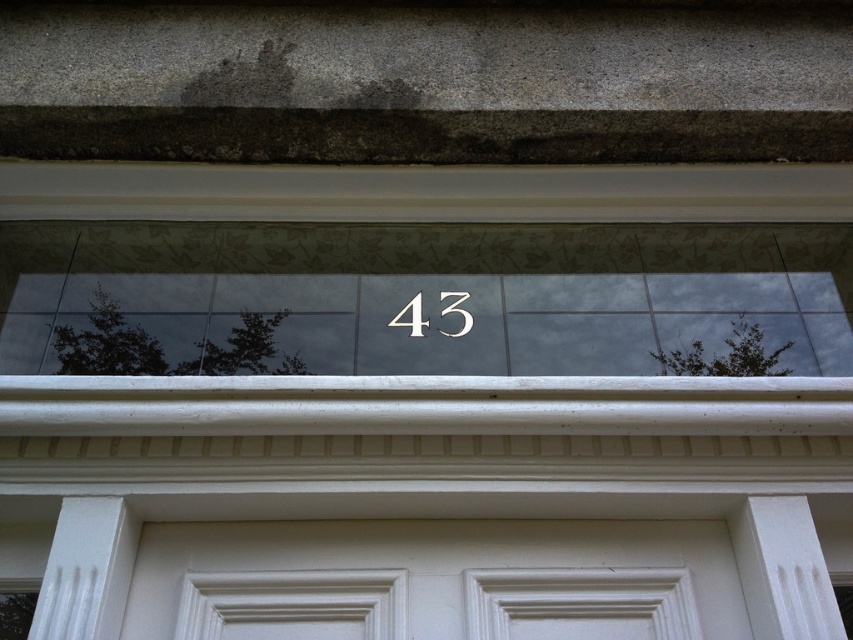
You are standing in front of the building and want to know which of the two points, point (1, 236) or point (409, 324), is closer to you. Based on the image, which point is nearer?

Point (1, 236) is closer to you because it is further to the viewer than point (409, 324).

You are a delivery person trying to read the address number on the building. The transparent glass at center and black metallic number at center are both in your line of sight. Which object is wider?

The transparent glass at center is wider than the black metallic number at center.

You are a delivery person trying to find the correct address. You see the transparent glass at center and the black metallic number at center. Which one is bigger in size?

The transparent glass at center is larger in size than the black metallic number at center.